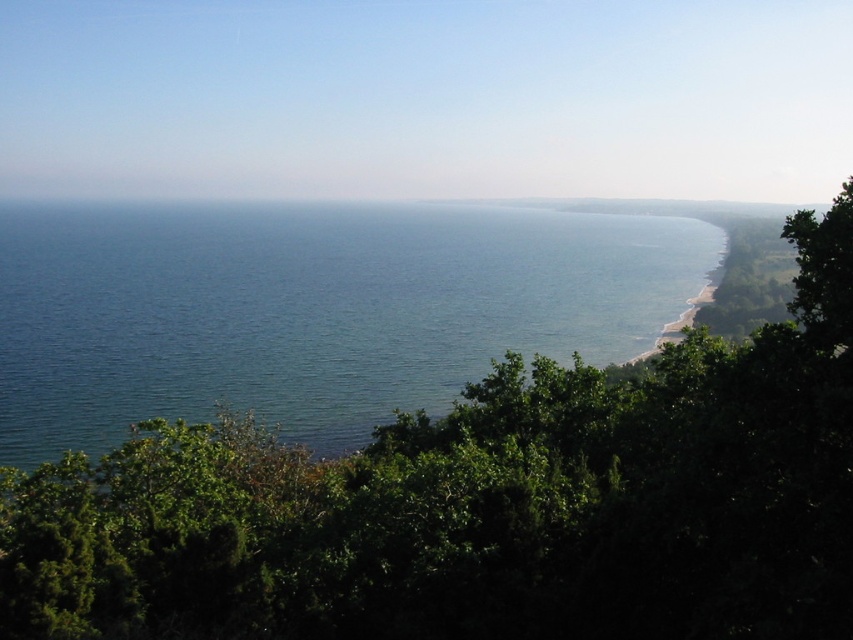
Question: Is blue water at center bigger than green leafy tree at right?

Choices:
 (A) yes
 (B) no

Answer: (A)

Question: Where is blue water at center located in relation to green leafy tree at right in the image?

Choices:
 (A) below
 (B) above

Answer: (B)

Question: Which point is closer to the camera?

Choices:
 (A) blue water at center
 (B) green leafy tree at right

Answer: (B)

Question: Is blue water at center in front of green leafy tree at right?

Choices:
 (A) yes
 (B) no

Answer: (B)